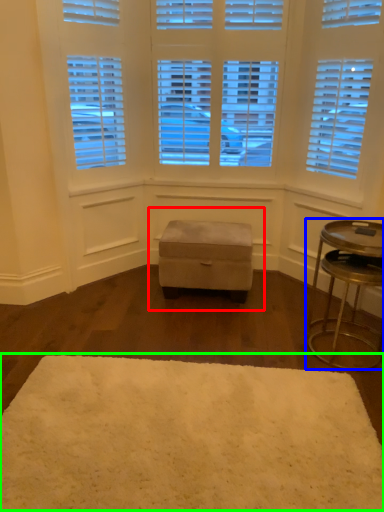
Question: Based on their relative distances, which object is nearer to music stool (highlighted by a red box)? Choose from table (highlighted by a blue box) and mat (highlighted by a green box).

Choices:
 (A) table
 (B) mat

Answer: (A)